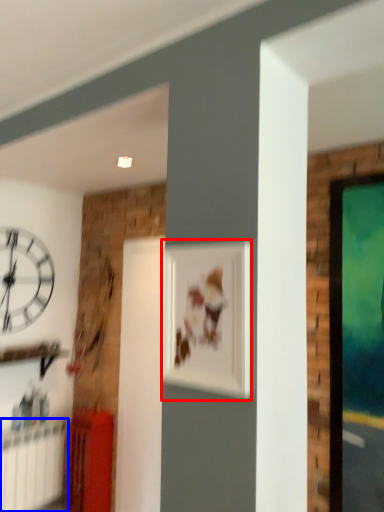
Question: Which of the following is the closest to the observer, picture frame (highlighted by a red box) or radiator (highlighted by a blue box)?

Choices:
 (A) picture frame
 (B) radiator

Answer: (A)